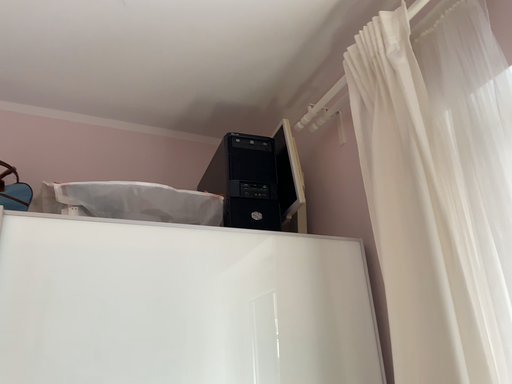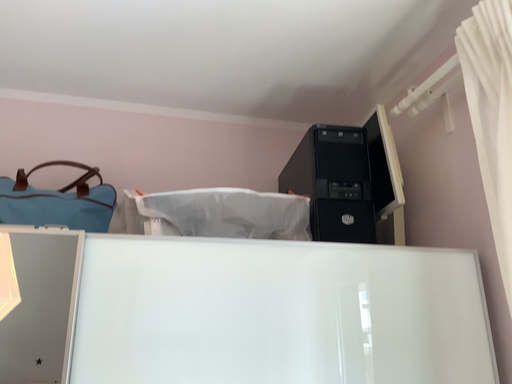
Question: How did the camera likely rotate when shooting the video?

Choices:
 (A) rotated left
 (B) rotated right

Answer: (A)